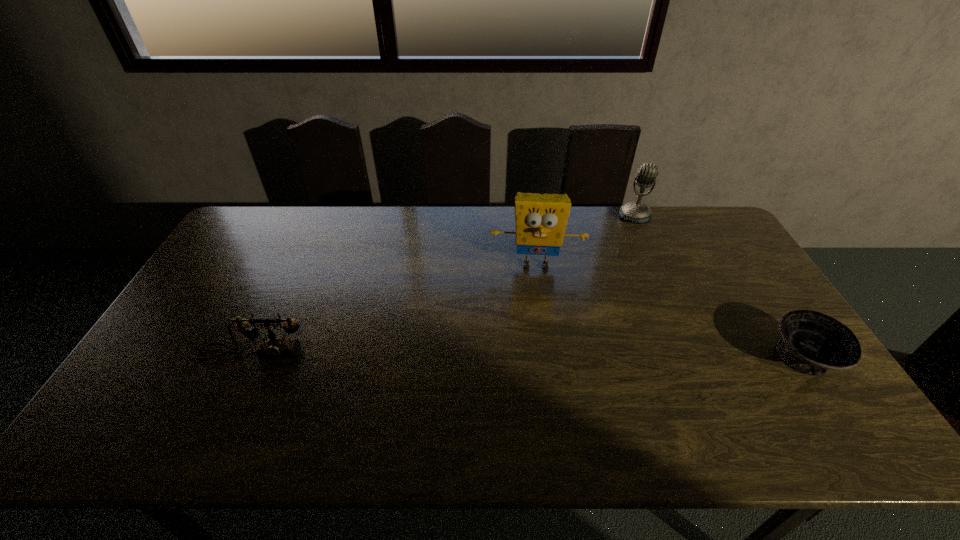
This screenshot has height=540, width=960. I want to click on the third tallest object, so click(x=275, y=347).

This screenshot has height=540, width=960. I want to click on telephone, so click(x=275, y=347).

Where is `bowl`? The height and width of the screenshot is (540, 960). bowl is located at coordinates (812, 343).

This screenshot has height=540, width=960. I want to click on the rightmost object, so click(x=812, y=343).

Where is `sponge`? sponge is located at coordinates (540, 219).

Locate an element on the screen. the third object from right to left is located at coordinates (540, 219).

This screenshot has width=960, height=540. I want to click on microphone, so click(637, 212).

This screenshot has width=960, height=540. Find the location of `the farthest object`. the farthest object is located at coordinates (637, 212).

Find the location of `free space located 0.050m on the front-facing side of the third tallest object`. free space located 0.050m on the front-facing side of the third tallest object is located at coordinates (242, 380).

This screenshot has height=540, width=960. In order to click on vacant point located 0.190m on the left of the rightmost object in this screenshot , I will do `click(697, 358)`.